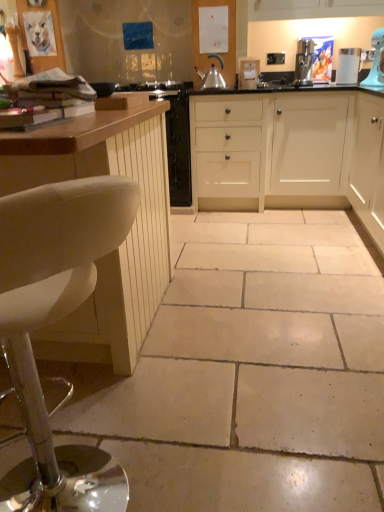
Question: Is white matte cabinet at right, marked as the first cabinetry in a right-to-left arrangement, far from satin silver kettle at center, which is the second kitchen appliance in right-to-left order?

Choices:
 (A) yes
 (B) no

Answer: (A)

Question: Is white matte cabinet at right, the 3th cabinetry from the left, completely or partially outside of satin silver kettle at center, which is the second kitchen appliance in right-to-left order?

Choices:
 (A) no
 (B) yes

Answer: (B)

Question: Is white matte cabinet at right, marked as the first cabinetry in a right-to-left arrangement, at the left side of satin silver kettle at center, which is the second kitchen appliance in right-to-left order?

Choices:
 (A) yes
 (B) no

Answer: (B)

Question: From a real-world perspective, is white matte cabinet at right, marked as the first cabinetry in a right-to-left arrangement, physically above satin silver kettle at center, which is the second kitchen appliance in right-to-left order?

Choices:
 (A) no
 (B) yes

Answer: (A)

Question: Can you confirm if white matte cabinet at right, the 3th cabinetry from the left, is smaller than satin silver kettle at center, which is the second kitchen appliance in right-to-left order?

Choices:
 (A) no
 (B) yes

Answer: (A)

Question: From the image's perspective, is white matte cabinet at right, marked as the first cabinetry in a right-to-left arrangement, beneath satin silver kettle at center, which is the second kitchen appliance in right-to-left order?

Choices:
 (A) no
 (B) yes

Answer: (B)

Question: Would you say satin silver kettle at center, which is counted as the first kitchen appliance, starting from the left, contains white matte cabinet at right, the 3th cabinetry from the left?

Choices:
 (A) no
 (B) yes

Answer: (A)

Question: Is satin silver kettle at center, which is the second kitchen appliance in right-to-left order, further to the viewer compared to white matte cabinet at right, marked as the first cabinetry in a right-to-left arrangement?

Choices:
 (A) no
 (B) yes

Answer: (B)

Question: Is satin silver kettle at center, which is counted as the first kitchen appliance, starting from the left, outside white matte cabinet at right, marked as the first cabinetry in a right-to-left arrangement?

Choices:
 (A) no
 (B) yes

Answer: (B)

Question: Is satin silver kettle at center, which is the second kitchen appliance in right-to-left order, shorter than white matte cabinet at right, the 3th cabinetry from the left?

Choices:
 (A) yes
 (B) no

Answer: (A)

Question: Is satin silver kettle at center, which is counted as the first kitchen appliance, starting from the left, far from white matte cabinet at right, the 3th cabinetry from the left?

Choices:
 (A) no
 (B) yes

Answer: (B)

Question: From a real-world perspective, is satin silver kettle at center, which is the second kitchen appliance in right-to-left order, below white matte cabinet at right, marked as the first cabinetry in a right-to-left arrangement?

Choices:
 (A) yes
 (B) no

Answer: (B)

Question: Is white leather stool at left in contact with beige tile floor at center?

Choices:
 (A) yes
 (B) no

Answer: (B)